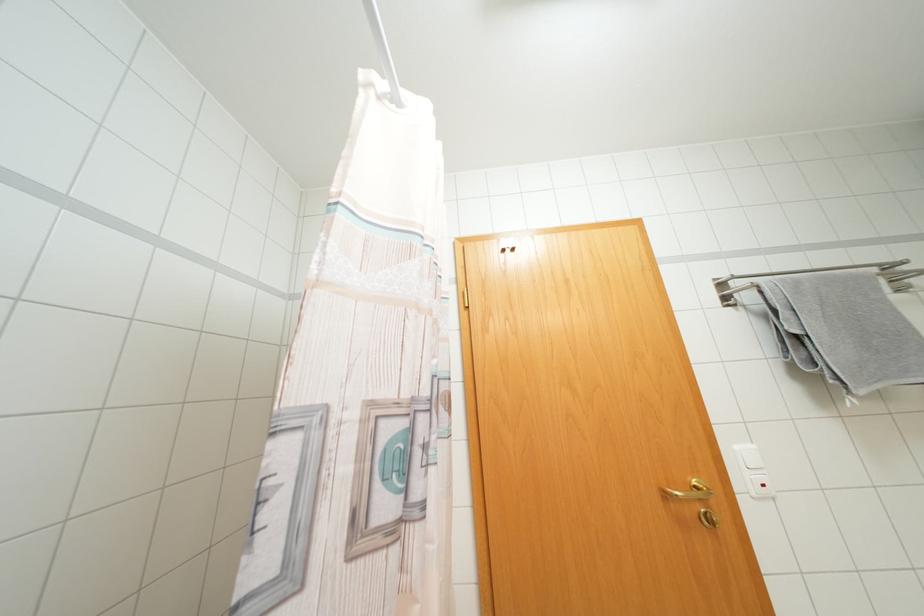
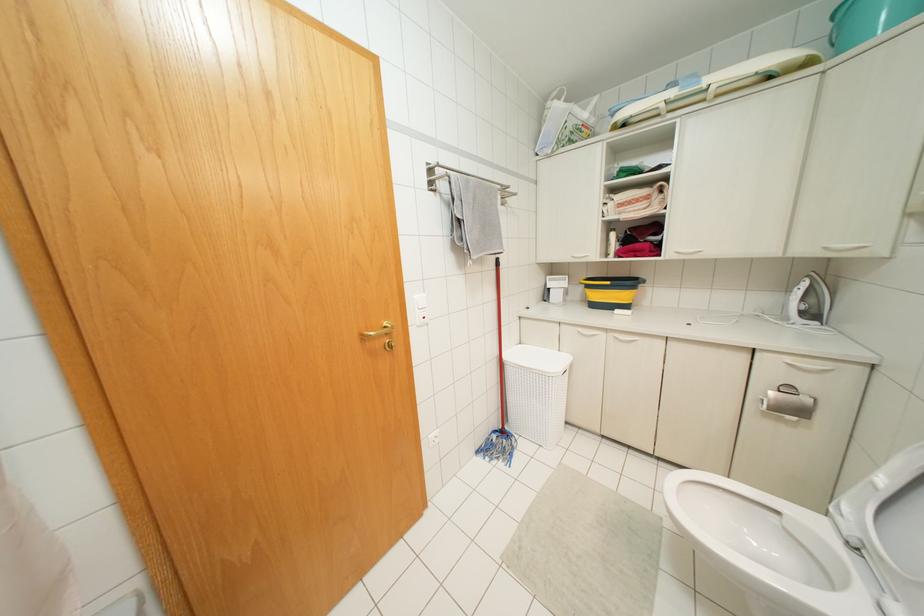
How did the camera likely rotate?

The camera's rotation is toward right-down.